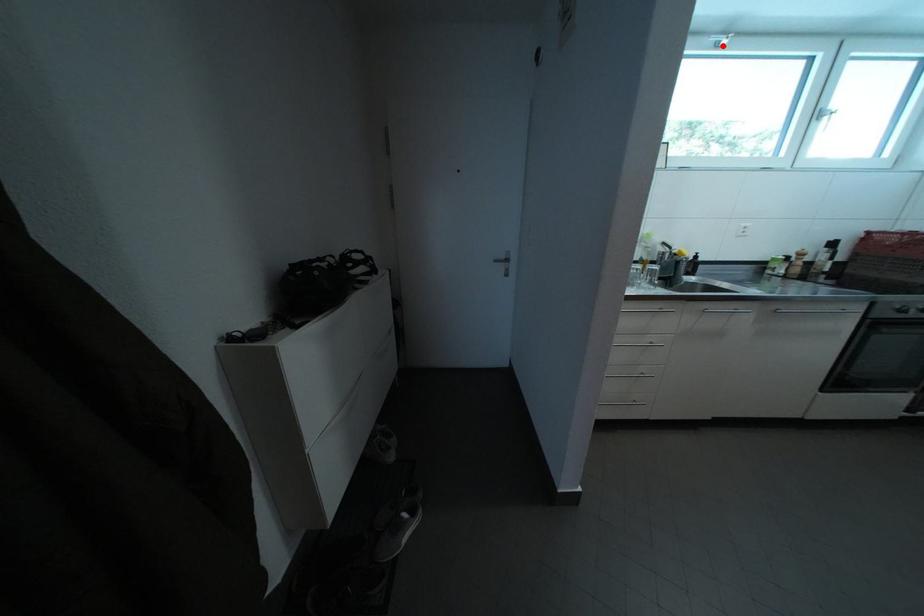
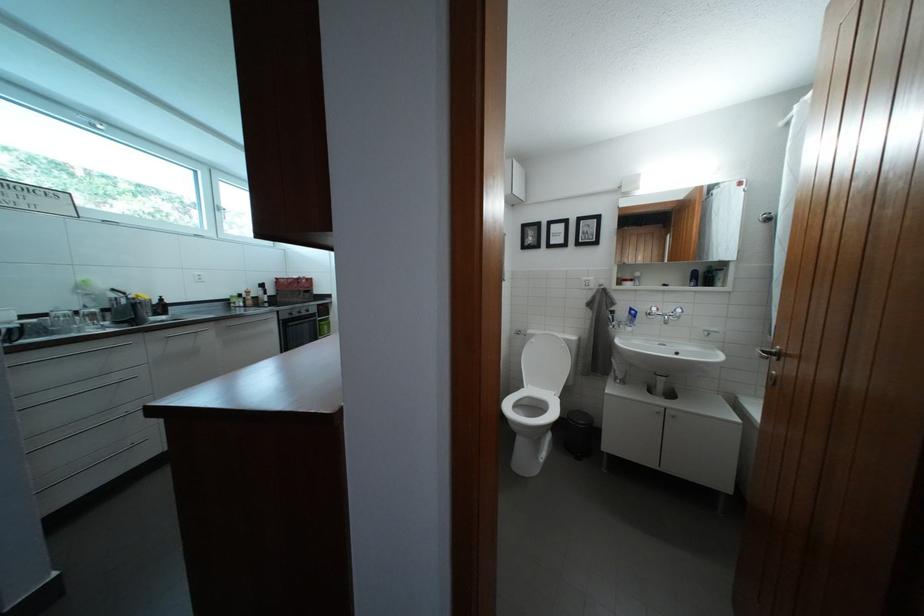
The point at the highlighted location is marked in the first image. Where is the corresponding point in the second image?

(94, 124)